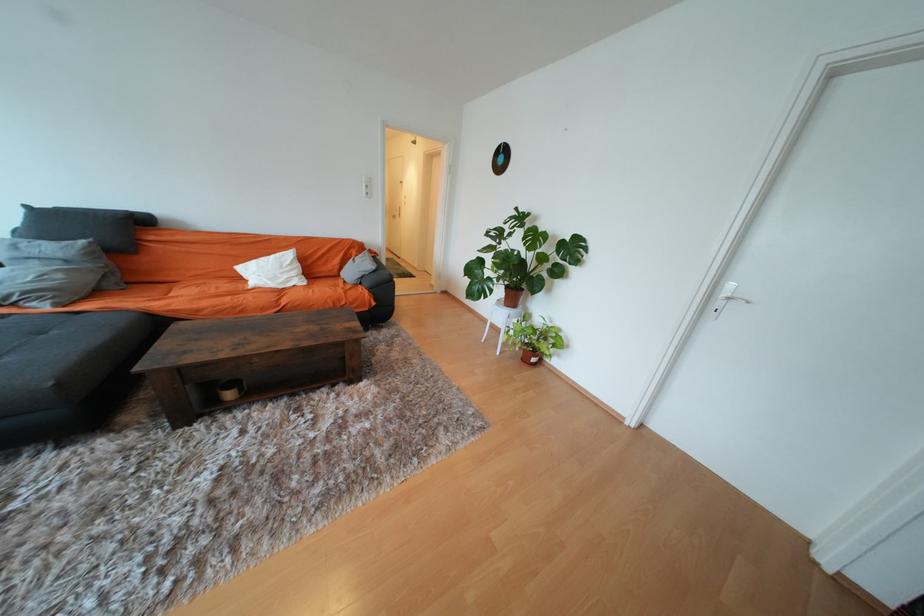
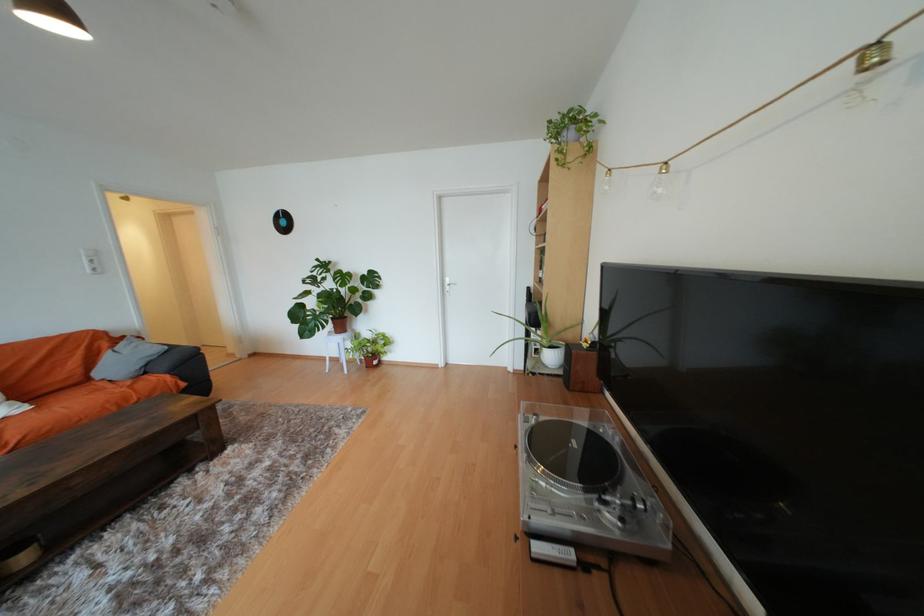
In the second image, find the point that corresponds to the point at 310,285 in the first image.

(31, 410)